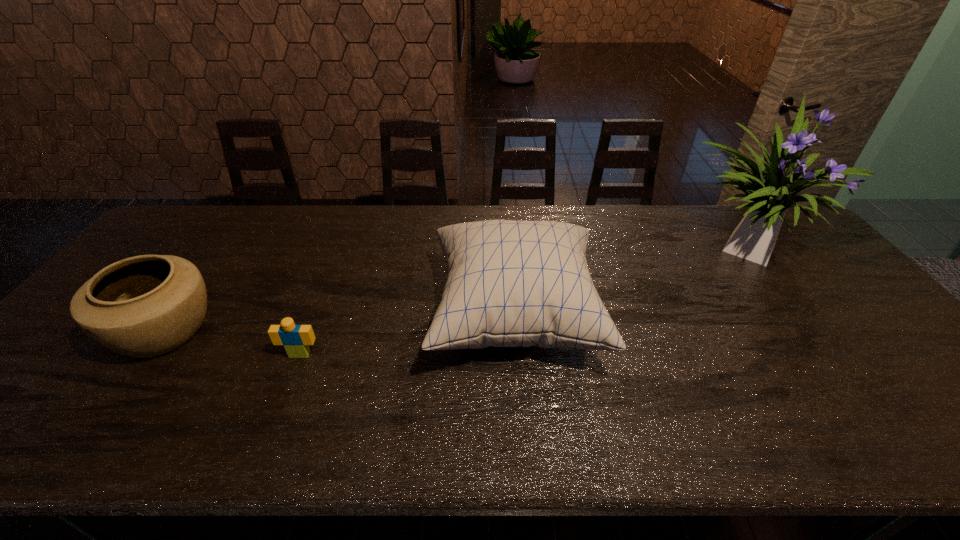
The height and width of the screenshot is (540, 960). What are the coordinates of `free space between the Lego and the cushion` in the screenshot? It's located at (407, 335).

This screenshot has height=540, width=960. Identify the location of vacant area that lies between the shortest object and the third object from left to right. (407, 335).

Locate an element on the screen. unoccupied area between the second tallest object and the Lego is located at coordinates (407, 335).

At what (x,y) coordinates should I click in order to perform the action: click on empty space that is in between the Lego and the pottery. Please return your answer as a coordinate pair (x, y). Looking at the image, I should click on (232, 343).

Locate which object ranks in proximity to the flower arrangement. Please provide its 2D coordinates. Your answer should be formatted as a tuple, i.e. [(x, y)], where the tuple contains the x and y coordinates of a point satisfying the conditions above.

[(509, 283)]

Locate which object ranks second in proximity to the pottery. Please provide its 2D coordinates. Your answer should be formatted as a tuple, i.e. [(x, y)], where the tuple contains the x and y coordinates of a point satisfying the conditions above.

[(509, 283)]

Find the location of a particular element. Image resolution: width=960 pixels, height=540 pixels. free space that satisfies the following two spatial constraints: 1. on the back side of the leftmost object; 2. on the left side of the rightmost object is located at coordinates (228, 244).